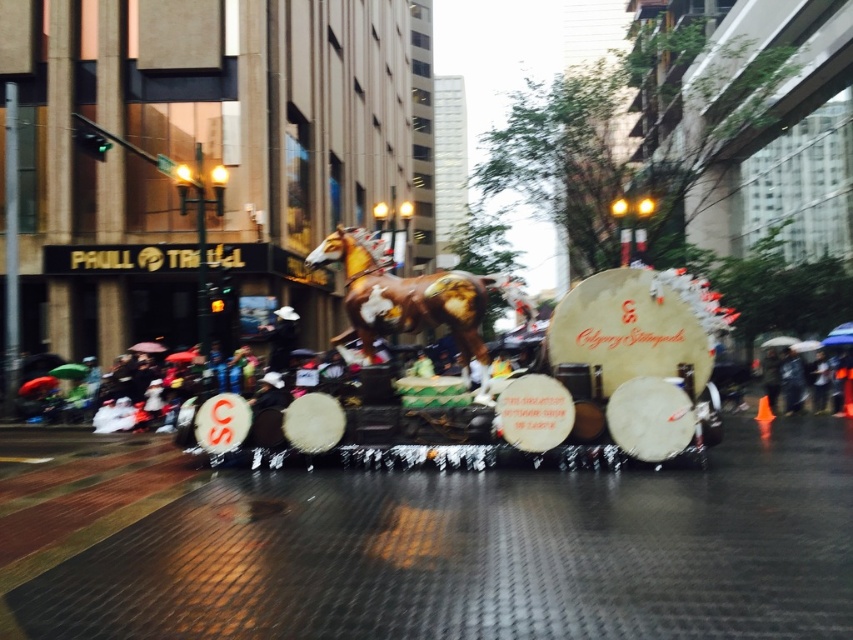
You are a photographer trying to capture the parade float with the horse statue. You notice a raincoat fabric person at lower right and a green fabric umbrella at center. Which object is positioned lower in the image?

The raincoat fabric person at lower right is positioned below the green fabric umbrella at center, so the raincoat fabric person at lower right is lower in the image.

You are a participant in the parade holding a black fabric umbrella at lower right. You notice another participant holding a raincoat fabric umbrella at lower right. Which umbrella is more likely to withstand heavy rain?

The raincoat fabric umbrella at lower right is thinner than the black fabric umbrella at lower right, so the black fabric umbrella at lower right is more likely to withstand heavy rain.